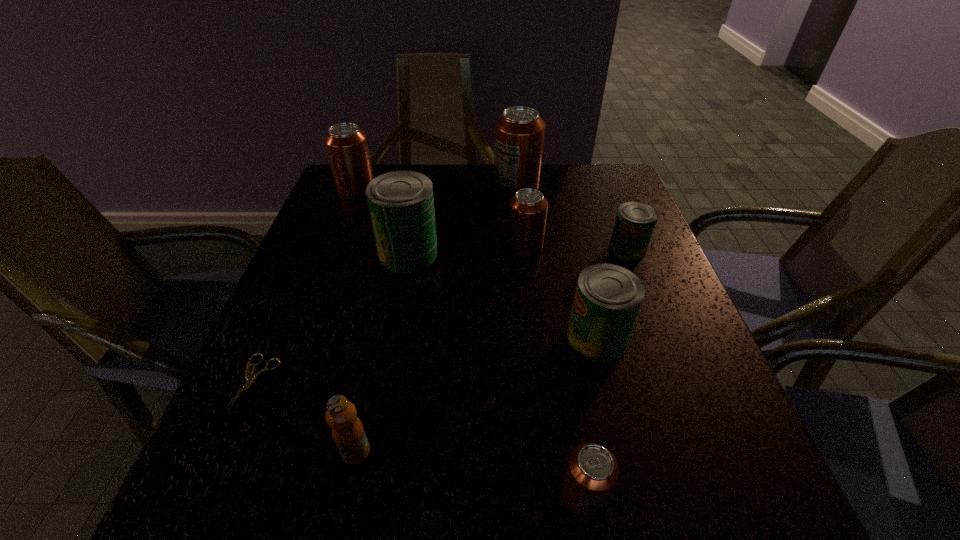
At what (x,y) coordinates should I click in order to perform the action: click on the smallest green can. Please return your answer as a coordinate pair (x, y). Looking at the image, I should click on (635, 221).

Where is `the rightmost object`? This screenshot has height=540, width=960. the rightmost object is located at coordinates (635, 221).

The height and width of the screenshot is (540, 960). Identify the location of the smallest orange can. (592, 472).

Identify the location of the nearest object. (592, 472).

The image size is (960, 540). Find the location of `shears`. shears is located at coordinates (251, 379).

You are a GUI agent. You are given a task and a screenshot of the screen. Output one action in this format:
    pyautogui.click(x=<x>, y=<y>)
    Task: Click on the beige shears
    The height and width of the screenshot is (540, 960).
    Given the screenshot: What is the action you would take?
    pyautogui.click(x=251, y=379)

The height and width of the screenshot is (540, 960). Find the location of `vacant space located on the left of the tallest object`. vacant space located on the left of the tallest object is located at coordinates (357, 187).

Identify the location of free spot located 0.270m on the front of the leftmost orange can. (327, 265).

The image size is (960, 540). In order to click on free space located on the right of the biggest green can in this screenshot , I will do `click(497, 253)`.

Where is `free spot located on the left of the third biggest orange can`? The image size is (960, 540). free spot located on the left of the third biggest orange can is located at coordinates click(387, 247).